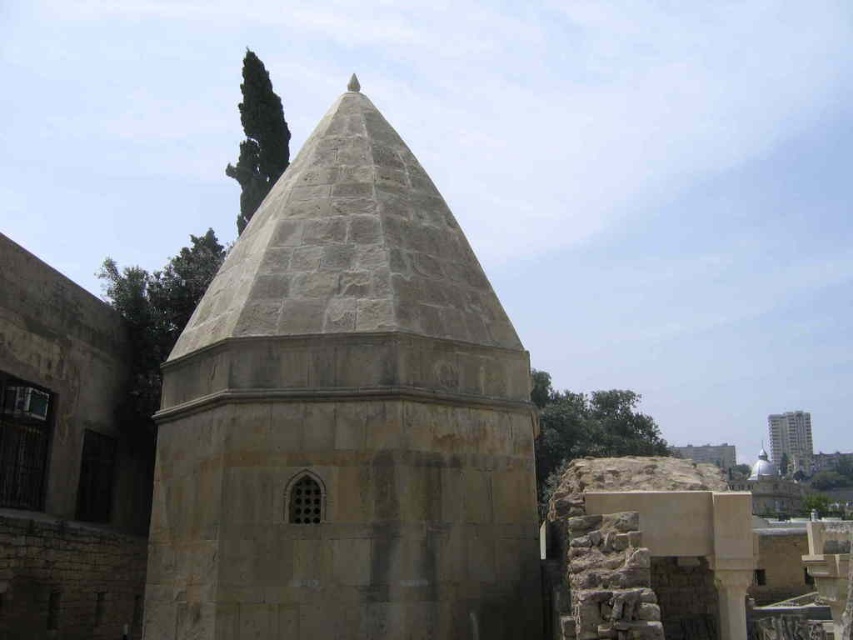
Question: Which of the following is the farthest from the observer?

Choices:
 (A) gray stone dome at center
 (B) smooth concrete tower at right

Answer: (B)

Question: Among these objects, which one is nearest to the camera?

Choices:
 (A) gray stone dome at center
 (B) smooth concrete tower at right

Answer: (A)

Question: Is gray stone dome at center above smooth concrete tower at right?

Choices:
 (A) no
 (B) yes

Answer: (B)

Question: Which object appears farthest from the camera in this image?

Choices:
 (A) gray stone dome at center
 (B) smooth concrete tower at right

Answer: (B)

Question: Does gray stone dome at center come behind smooth concrete tower at right?

Choices:
 (A) no
 (B) yes

Answer: (A)

Question: Is gray stone dome at center wider than smooth concrete tower at right?

Choices:
 (A) yes
 (B) no

Answer: (B)